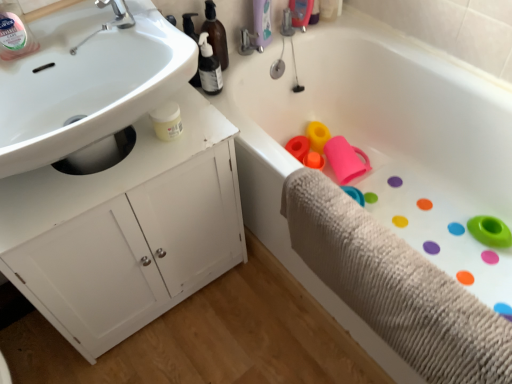
Measure the distance between point (33, 132) and camera.

Point (33, 132) is 3.30 feet from camera.

Image resolution: width=512 pixels, height=384 pixels. What do you see at coordinates (15, 32) in the screenshot? I see `clear plastic bottle at upper left` at bounding box center [15, 32].

Describe the element at coordinates (126, 230) in the screenshot. I see `white matte cabinet at left` at that location.

At what (x,y) coordinates should I click in order to perform the action: click on white glossy sink at upper left. Please return your answer as a coordinate pair (x, y). Looking at the image, I should click on (87, 82).

Can you confirm if white glossy sink at upper left is taller than clear plastic bottle at upper left?

Yes, white glossy sink at upper left is taller than clear plastic bottle at upper left.

Identify the location of bottle above the white glossy sink at upper left (from the image's perspective). (15, 32).

Is white glossy sink at upper left positioned beyond the bounds of clear plastic bottle at upper left?

Absolutely, white glossy sink at upper left is external to clear plastic bottle at upper left.

Based on the photo, which is nearer, (381,241) or (247,63)?

Positioned in front is point (381,241).

How many degrees apart are the facing directions of beige textured bath towel at lower right and white rubber bathtub at center?

3.86e-05 degrees separate the facing orientations of beige textured bath towel at lower right and white rubber bathtub at center.

Visually, is beige textured bath towel at lower right positioned to the left or to the right of white rubber bathtub at center?

From the image, it's evident that beige textured bath towel at lower right is to the left of white rubber bathtub at center.

Is beige textured bath towel at lower right facing away from white rubber bathtub at center?

That's right, beige textured bath towel at lower right is facing away from white rubber bathtub at center.

Is silver metallic faucet at upper left inside or outside of clear plastic bottle at upper left?

silver metallic faucet at upper left is not inside clear plastic bottle at upper left, it's outside.

Which of these two, silver metallic faucet at upper left or clear plastic bottle at upper left, is bigger?

clear plastic bottle at upper left is bigger.

Which is in front, point (97, 1) or point (7, 54)?

The point (7, 54) is more forward.

Would you say white glossy sink at upper left is a long distance from silver metallic faucet at upper left?

They are positioned close to each other.

Is white glossy sink at upper left to the right of silver metallic faucet at upper left from the viewer's perspective?

In fact, white glossy sink at upper left is to the left of silver metallic faucet at upper left.

Which is behind, point (186, 54) or point (118, 18)?

The point (118, 18) is behind.

Is beige textured bath towel at lower right facing away from white glossy sink at upper left?

No, beige textured bath towel at lower right is not facing away from white glossy sink at upper left.

From a real-world perspective, is beige textured bath towel at lower right physically above white glossy sink at upper left?

No, from a real-world perspective, beige textured bath towel at lower right is not on top of white glossy sink at upper left.

Looking at the image, does beige textured bath towel at lower right seem bigger or smaller compared to white glossy sink at upper left?

beige textured bath towel at lower right is smaller than white glossy sink at upper left.

Would you consider beige textured bath towel at lower right to be distant from white glossy sink at upper left?

beige textured bath towel at lower right is actually quite close to white glossy sink at upper left.

Would you say clear plastic bottle at upper left is inside or outside white matte cabinet at left?

clear plastic bottle at upper left is spatially situated outside white matte cabinet at left.

From a real-world perspective, is clear plastic bottle at upper left physically located above or below white matte cabinet at left?

clear plastic bottle at upper left is situated higher than white matte cabinet at left in the real world.

Is clear plastic bottle at upper left facing away from white matte cabinet at left?

That's not correct — clear plastic bottle at upper left is not looking away from white matte cabinet at left.

How different are the orientations of clear plastic bottle at upper left and white matte cabinet at left in degrees?

clear plastic bottle at upper left and white matte cabinet at left are facing 1.34 degrees away from each other.

Where is `bathroom cabinet above the beige textured bath towel at lower right (from the image's perspective)`? bathroom cabinet above the beige textured bath towel at lower right (from the image's perspective) is located at coordinates (126, 230).

Could you tell me if white matte cabinet at left is turned towards beige textured bath towel at lower right?

Yes.

Which is more to the left, white matte cabinet at left or beige textured bath towel at lower right?

Positioned to the left is white matte cabinet at left.

Considering the sizes of objects white matte cabinet at left and beige textured bath towel at lower right in the image provided, who is wider, white matte cabinet at left or beige textured bath towel at lower right?

white matte cabinet at left.

This screenshot has height=384, width=512. Find the location of `bottle that is above the white glossy sink at upper left (from the image's perspective)`. bottle that is above the white glossy sink at upper left (from the image's perspective) is located at coordinates (15, 32).

The width and height of the screenshot is (512, 384). I want to click on bathtub located in front of the beige textured bath towel at lower right, so click(378, 149).

When comparing their distances from clear plastic bottle at upper left, does white glossy sink at upper left or white rubber bathtub at center seem further?

white rubber bathtub at center.

Estimate the real-world distances between objects in this image. Which object is further from white glossy sink at upper left, white rubber bathtub at center or silver metallic faucet at upper left?

white rubber bathtub at center is further to white glossy sink at upper left.

Looking at the image, which one is located closer to clear plastic bottle at upper left, white glossy sink at upper left or white matte cabinet at left?

The object closer to clear plastic bottle at upper left is white glossy sink at upper left.

Considering their positions, is clear plastic bottle at upper left positioned further to beige textured bath towel at lower right than white matte cabinet at left?

The object further to beige textured bath towel at lower right is clear plastic bottle at upper left.

From the image, which object appears to be farther from white matte cabinet at left, clear plastic bottle at upper left or silver metallic faucet at upper left?

Based on the image, silver metallic faucet at upper left appears to be further to white matte cabinet at left.

When comparing their distances from white matte cabinet at left, does white rubber bathtub at center or silver metallic faucet at upper left seem further?

silver metallic faucet at upper left is further to white matte cabinet at left.

From the image, which object appears to be nearer to white rubber bathtub at center, white matte cabinet at left or beige textured bath towel at lower right?

beige textured bath towel at lower right is positioned closer to the anchor white rubber bathtub at center.

Which object lies nearer to the anchor point white matte cabinet at left, beige textured bath towel at lower right or silver metallic faucet at upper left?

beige textured bath towel at lower right lies closer to white matte cabinet at left than the other object.

The height and width of the screenshot is (384, 512). I want to click on bottle located between white glossy sink at upper left and silver metallic faucet at upper left in the depth direction, so click(15, 32).

Identify the location of tap situated between clear plastic bottle at upper left and white rubber bathtub at center from left to right. (117, 14).

Identify the location of tap between white glossy sink at upper left and beige textured bath towel at lower right. This screenshot has width=512, height=384. (117, 14).

Locate an element on the screen. The height and width of the screenshot is (384, 512). bathroom cabinet between white glossy sink at upper left and white rubber bathtub at center is located at coordinates (126, 230).